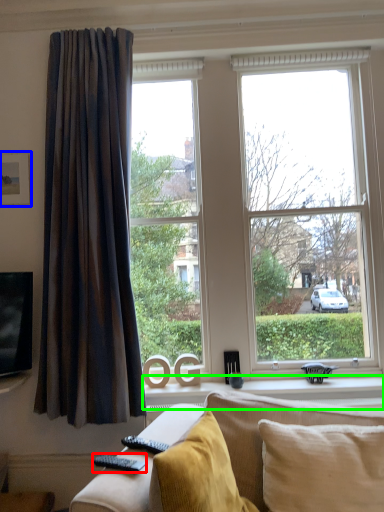
Question: Based on their relative distances, which object is farther from remote (highlighted by a red box)? Choose from picture frame (highlighted by a blue box) and window sill (highlighted by a green box).

Choices:
 (A) picture frame
 (B) window sill

Answer: (A)